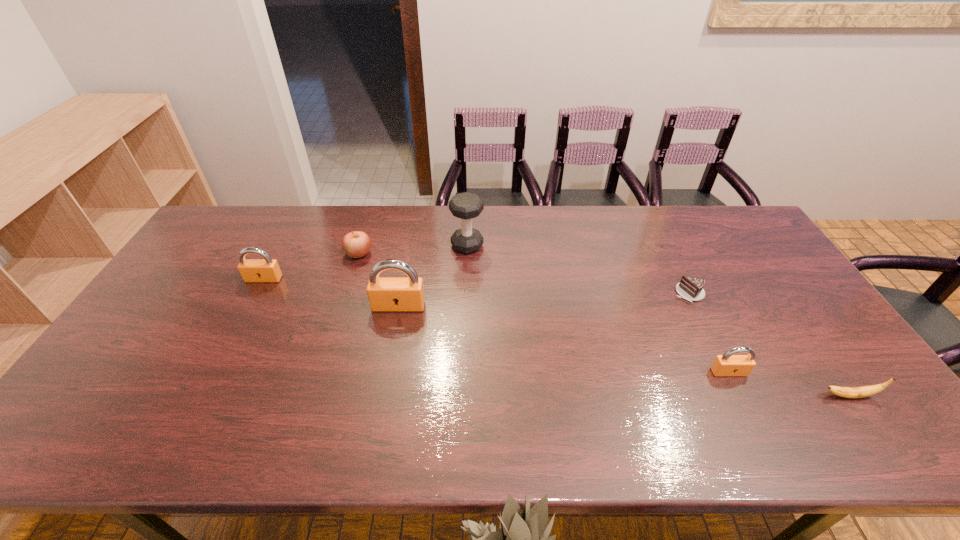
Please point a spot to place another padlock for symmetrical spacing. Please provide its 2D coordinates. Your answer should be formatted as a tuple, i.e. [(x, y)], where the tuple contains the x and y coordinates of a point satisfying the conditions above.

[(552, 336)]